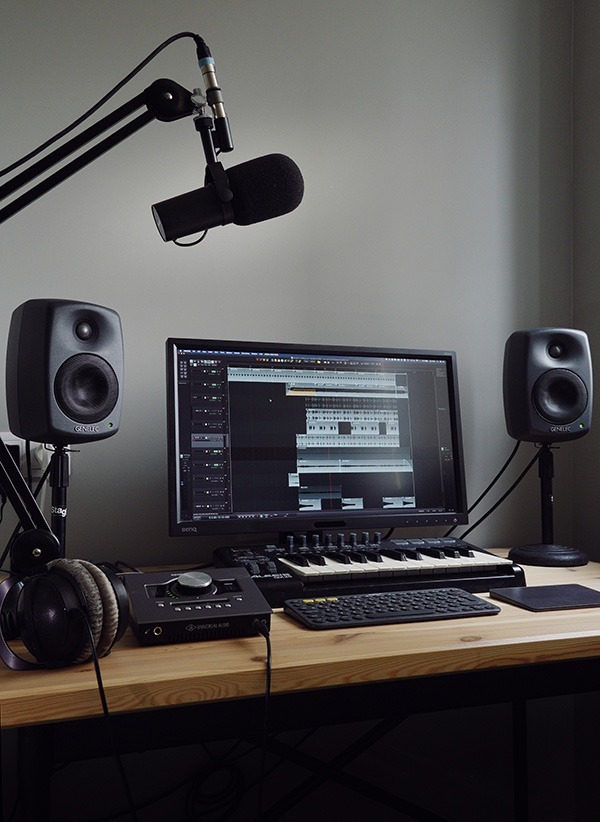
You are a GUI agent. You are given a task and a screenshot of the screen. Output one action in this format:
    pyautogui.click(x=<x>, y=<y>)
    Task: Click on the cord
    The width and height of the screenshot is (600, 822).
    Given the screenshot: What is the action you would take?
    pyautogui.click(x=267, y=656), pyautogui.click(x=94, y=676), pyautogui.click(x=44, y=476), pyautogui.click(x=24, y=465), pyautogui.click(x=204, y=238), pyautogui.click(x=515, y=487), pyautogui.click(x=497, y=473)